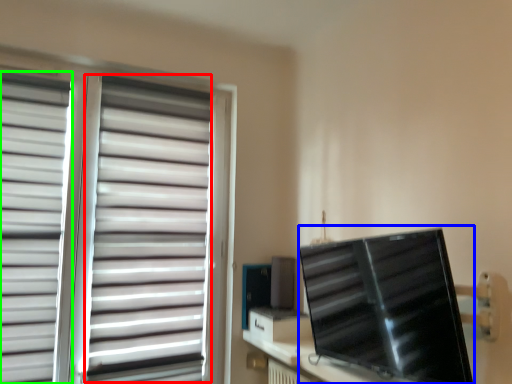
Question: Based on their relative distances, which object is nearer to curtain (highlighted by a red box)? Choose from computer monitor (highlighted by a blue box) and curtain (highlighted by a green box).

Choices:
 (A) computer monitor
 (B) curtain

Answer: (B)